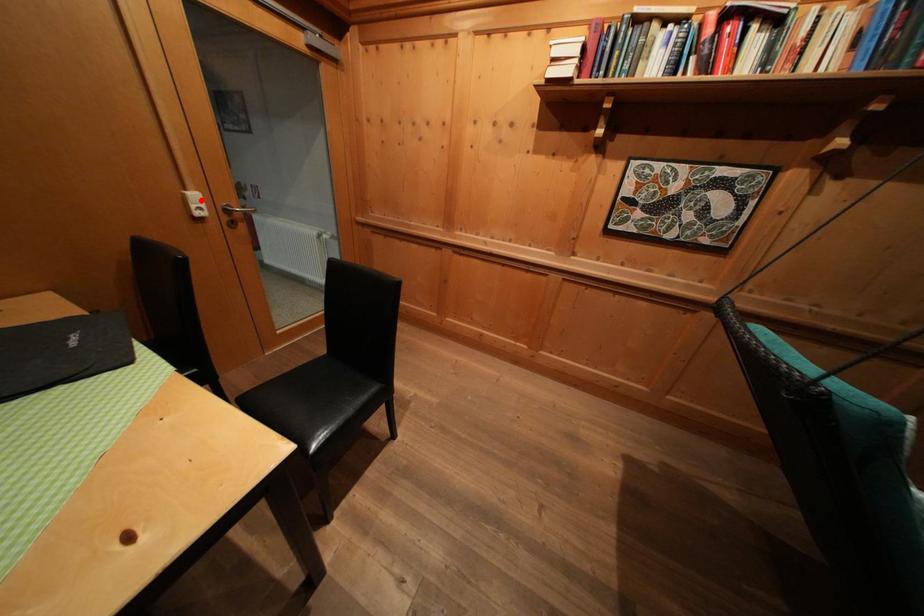
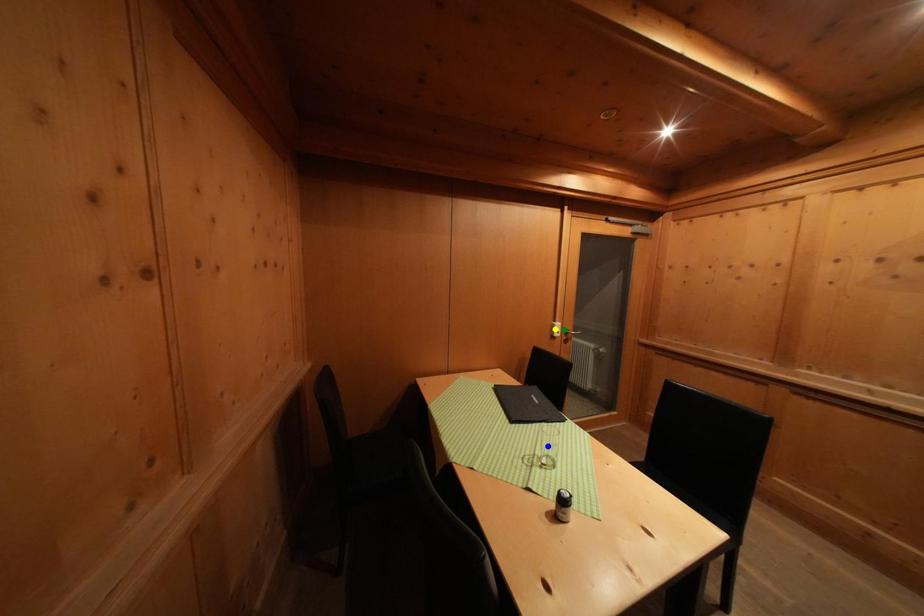
Question: I am providing you with two images of the same scene from different viewpoints. A red point is marked on the first image. You are given multiple points on the second image. Which point in image 2 is actually the same real-world point as the red point in image 1?

Choices:
 (A) green point
 (B) blue point
 (C) yellow point

Answer: (A)